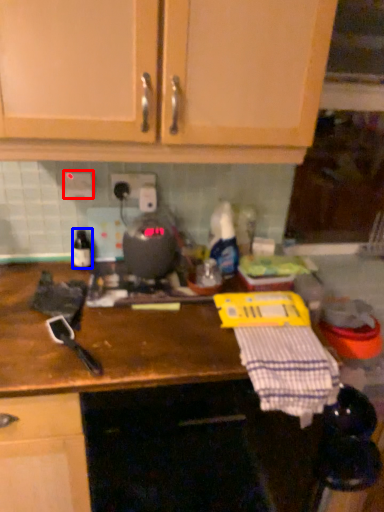
Question: Which object appears farthest to the camera in this image, electric outlet (highlighted by a red box) or bottle (highlighted by a blue box)?

Choices:
 (A) electric outlet
 (B) bottle

Answer: (B)